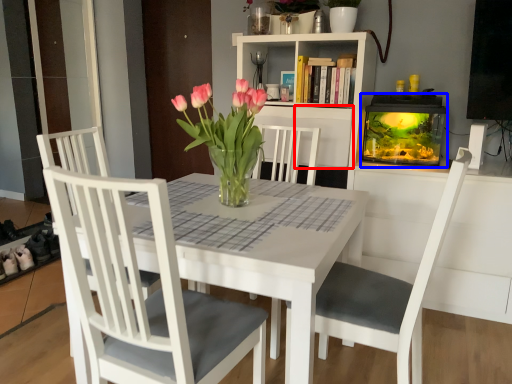
Question: Which object is further to the camera taking this photo, shelf (highlighted by a red box) or fireplace (highlighted by a blue box)?

Choices:
 (A) shelf
 (B) fireplace

Answer: (A)